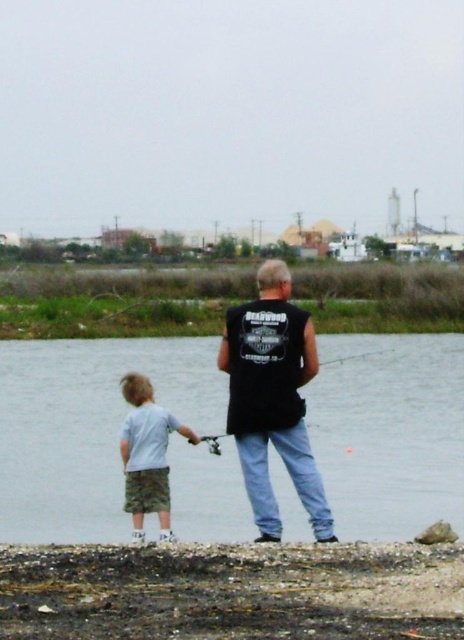
Question: Is black sleeveless shirt at center to the right of matte black fishing pole at center from the viewer's perspective?

Choices:
 (A) yes
 (B) no

Answer: (B)

Question: Which of the following is the closest to the observer?

Choices:
 (A) clear water at center
 (B) matte black fishing pole at center
 (C) black sleeveless shirt at center

Answer: (C)

Question: Does light gray cotton shirt at lower left appear on the right side of matte black fishing pole at center?

Choices:
 (A) no
 (B) yes

Answer: (A)

Question: Considering the real-world distances, which object is closest to the clear water at center?

Choices:
 (A) black sleeveless shirt at center
 (B) matte black fishing pole at center
 (C) light gray cotton shirt at lower left

Answer: (B)

Question: Can you confirm if black sleeveless shirt at center is positioned to the right of light gray cotton shirt at lower left?

Choices:
 (A) no
 (B) yes

Answer: (B)

Question: Which object appears closest to the camera in this image?

Choices:
 (A) matte black fishing pole at center
 (B) light gray cotton shirt at lower left
 (C) clear water at center

Answer: (A)